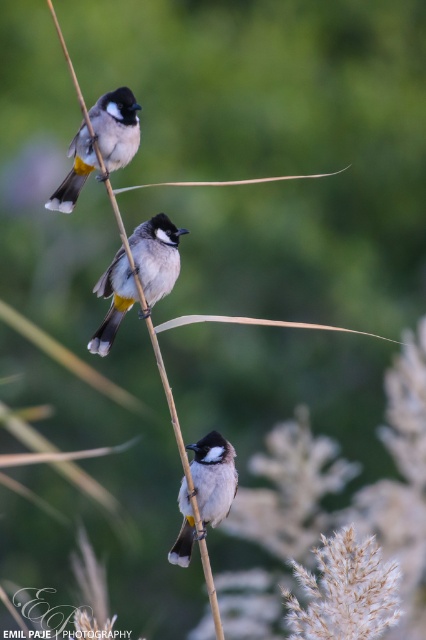
Based on the photo, you are a birdwatcher trying to determine the order of the birds from front to back based on their positions. If the birds are located at point (146, 228) and point (89, 141), which bird is farther away from you?

Point (146, 228) is behind point (89, 141), so the bird at point (146, 228) is farther away.

You are a photographer standing at the camera position. You want to capture a closeup shot of the gray matte bird at center. Considering the current distance, will you need to use a telephoto lens to get a clear closeup?

The gray matte bird at center is 11.00 feet away from camera. A telephoto lens is typically used for capturing distant subjects beyond normal reach. Since 11 feet is a moderate distance, you might not need a telephoto lens unless you require extreme magnification. A standard lens could suffice for a closeup at this distance.